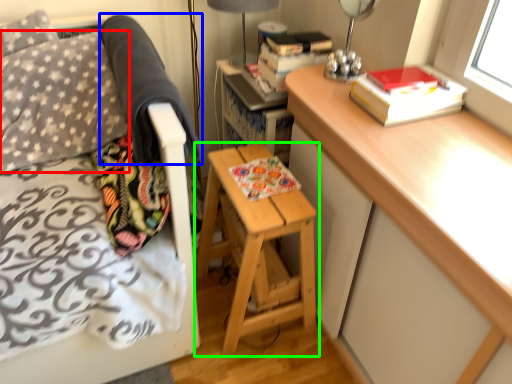
Question: Considering the real-world distances, which object is closest to throw pillow (highlighted by a red box)? blanket (highlighted by a blue box) or stool (highlighted by a green box).

Choices:
 (A) blanket
 (B) stool

Answer: (A)